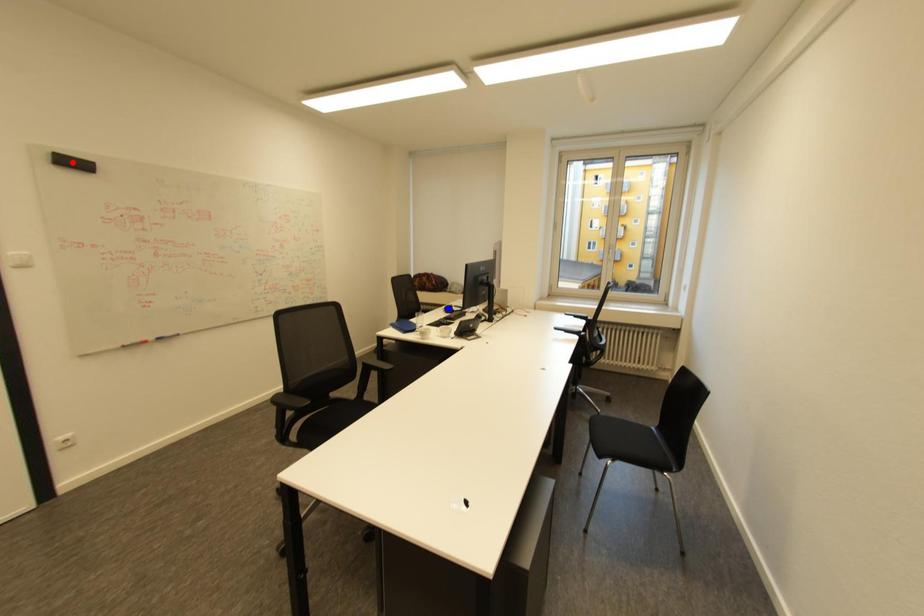
Question: Two points are marked on the image. Which point is closer to the camera?

Choices:
 (A) Blue point is closer.
 (B) Red point is closer.

Answer: (B)